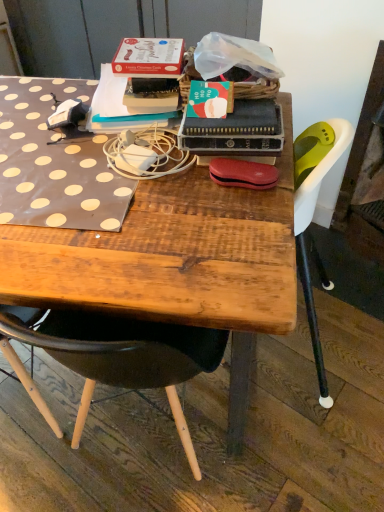
Question: Based on their sizes in the image, would you say wooden desk at center is bigger or smaller than hardcover book at center?

Choices:
 (A) big
 (B) small

Answer: (A)

Question: Is wooden desk at center taller or shorter than hardcover book at center?

Choices:
 (A) tall
 (B) short

Answer: (A)

Question: Which is nearer to the wooden desk at center?

Choices:
 (A) white matte charger at center
 (B) hardcover book at center
 (C) matte red pouch at center

Answer: (A)

Question: Estimate the real-world distances between objects in this image. Which object is farther from the wooden desk at center?

Choices:
 (A) matte red pouch at center
 (B) white matte charger at center
 (C) hardcover book at center

Answer: (A)